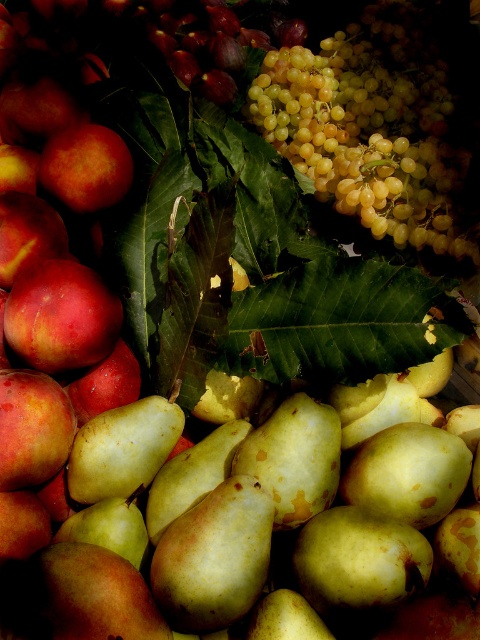
Can you confirm if matte peach at left is bigger than matte red apple at center?

Indeed, matte peach at left has a larger size compared to matte red apple at center.

Does point (24, 216) lie in front of point (136, 376)?

That is True.

Between point (49, 212) and point (87, 388), which one is positioned behind?

The point (49, 212) is behind.

Locate an element on the screen. Image resolution: width=480 pixels, height=640 pixels. matte peach at left is located at coordinates (27, 234).

Can you confirm if matte red apple at lower left is positioned below matte red apple at center?

Indeed, matte red apple at lower left is positioned under matte red apple at center.

Is matte red apple at lower left shorter than matte red apple at center?

In fact, matte red apple at lower left may be taller than matte red apple at center.

In order to click on matte red apple at lower left in this screenshot , I will do `click(33, 428)`.

Identify the location of matte red apple at lower left. (33, 428).

Is yellow matte grapes at upper right thinner than shiny red apple at upper left?

Incorrect, yellow matte grapes at upper right's width is not less than shiny red apple at upper left's.

You are a GUI agent. You are given a task and a screenshot of the screen. Output one action in this format:
    pyautogui.click(x=<x>, y=<y>)
    Task: Click on the yellow matte grapes at upper right
    This screenshot has width=480, height=640.
    Given the screenshot: What is the action you would take?
    pyautogui.click(x=371, y=125)

Find the location of a particular element. yellow matte grapes at upper right is located at coordinates (371, 125).